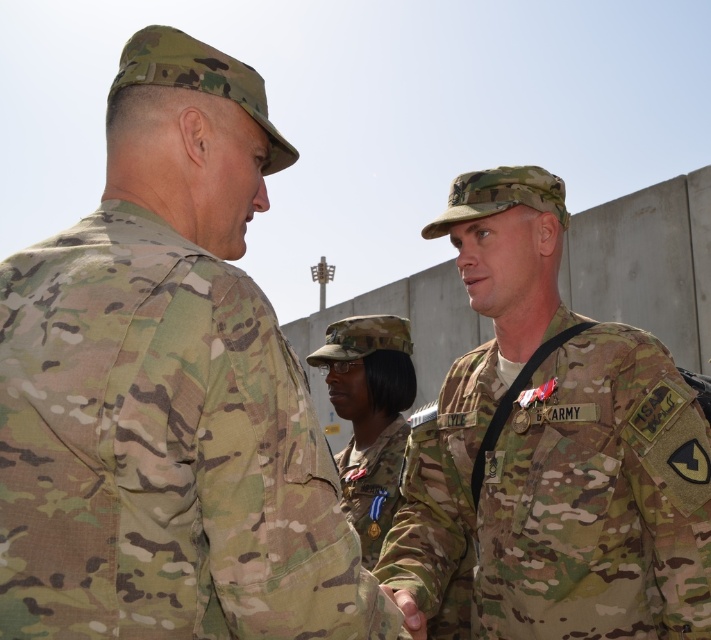
Is camo uniform at center wider than camouflage fabric uniform at center?

Yes, camo uniform at center is wider than camouflage fabric uniform at center.

Which of these two, camo uniform at center or camouflage fabric uniform at center, stands shorter?

Standing shorter between the two is camouflage fabric uniform at center.

Is point (599, 579) positioned behind point (373, 540)?

No.

Locate an element on the screen. The height and width of the screenshot is (640, 711). camo uniform at center is located at coordinates (550, 449).

Does multicam uniform at center have a larger size compared to camouflage fabric uniform at center?

Yes, multicam uniform at center is bigger than camouflage fabric uniform at center.

Who is positioned more to the left, multicam uniform at center or camouflage fabric uniform at center?

From the viewer's perspective, multicam uniform at center appears more on the left side.

Does point (11, 291) lie behind point (370, 483)?

No, (11, 291) is in front of (370, 483).

Find the location of `multicam uniform at center`. multicam uniform at center is located at coordinates (166, 392).

Between multicam uniform at center and camo uniform at center, which one is positioned higher?

multicam uniform at center is higher up.

Is multicam uniform at center taller than camo uniform at center?

No, multicam uniform at center is not taller than camo uniform at center.

The image size is (711, 640). Describe the element at coordinates (166, 392) in the screenshot. I see `multicam uniform at center` at that location.

Identify the location of multicam uniform at center. The height and width of the screenshot is (640, 711). (166, 392).